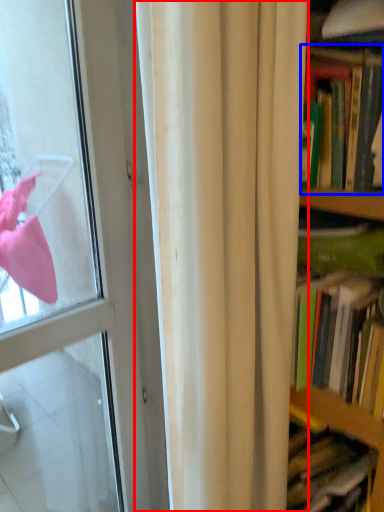
Question: Which object appears closest to the camera in this image, curtain (highlighted by a red box) or book (highlighted by a blue box)?

Choices:
 (A) curtain
 (B) book

Answer: (A)